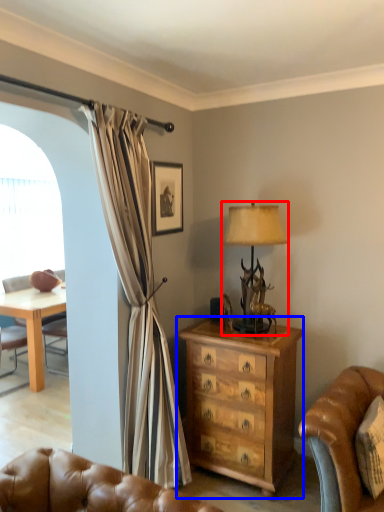
Question: Which object appears farthest to the camera in this image, lamp (highlighted by a red box) or chest of drawers (highlighted by a blue box)?

Choices:
 (A) lamp
 (B) chest of drawers

Answer: (A)